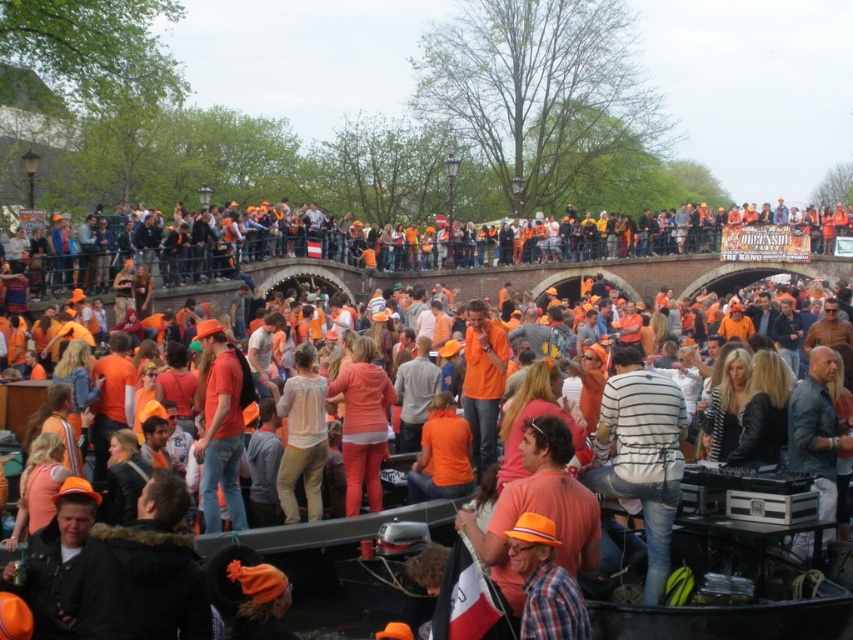
You are standing in the crowd at the festival and want to move from your current position to a spot closer to the bridge. You notice two points marked in the image. Which point, point 1 at coordinates (379, 445) or point 2 at (560, 544), is closer to you and would be a better starting point for your path towards the bridge?

Point 1 at coordinates (379, 445) is closer to you, so it would be a better starting point for your path towards the bridge since it is further to the viewer than point 2 at (560, 544).

Looking at this image, you are a photographer trying to capture a photo of the matte orange shirt at center and the plaid fabric hat at center. Based on their sizes, which object should you focus on first to ensure both fit in the frame?

The matte orange shirt at center might be wider than plaid fabric hat at center, so focusing on the matte orange shirt at center first would ensure both fit in the frame.

You are a photographer standing at the edge of the crowd, aiming to capture a photo of both the matte orange shirt at center and the plaid fabric hat at center in the same frame. Your camera has a maximum focal length that allows capturing objects within a 15 meter range. Will you be able to include both subjects in your photo?

The distance between the matte orange shirt at center and the plaid fabric hat at center is 17.59 meters, which exceeds the camera maximum focal length of 15 meters. Therefore, you won not be able to include both subjects in the same frame.